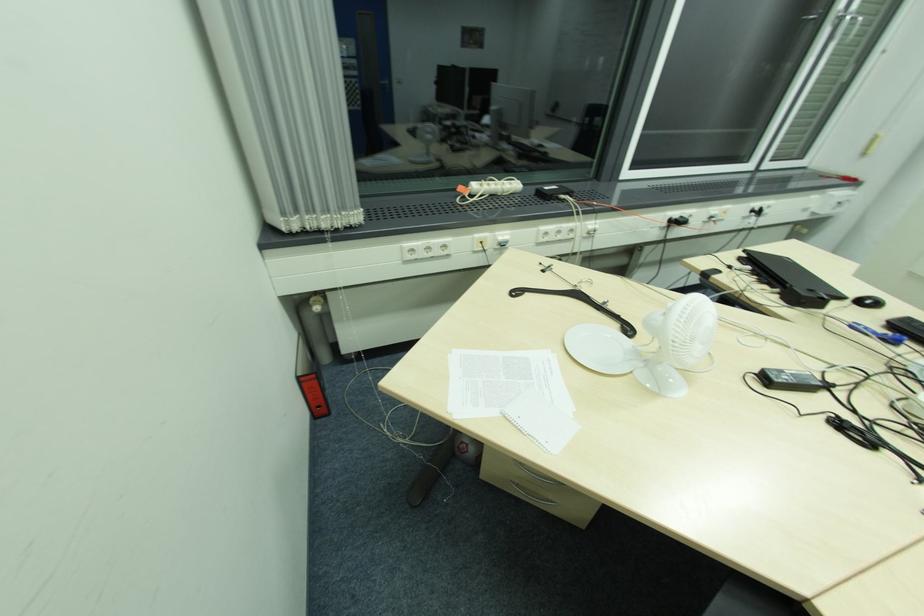
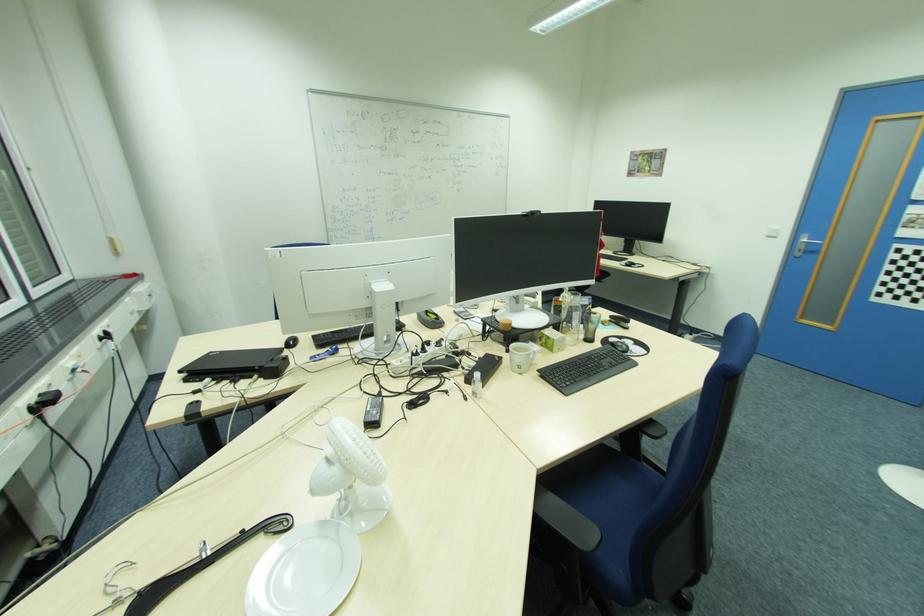
The point at (618, 317) is marked in the first image. Where is the corresponding point in the second image?

(246, 538)